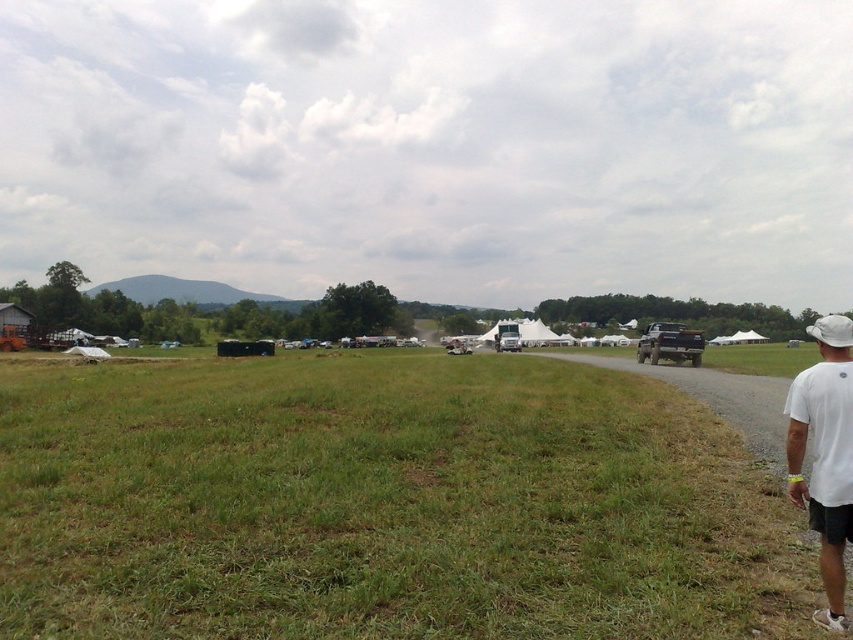
You are standing at the origin point of the coordinate system in the image. You want to walk to the green grass at center. According to the coordinate system, in which direction should you move?

The green grass at center is located at coordinate point (384, 502), so you should move towards the right and forward direction to reach it.